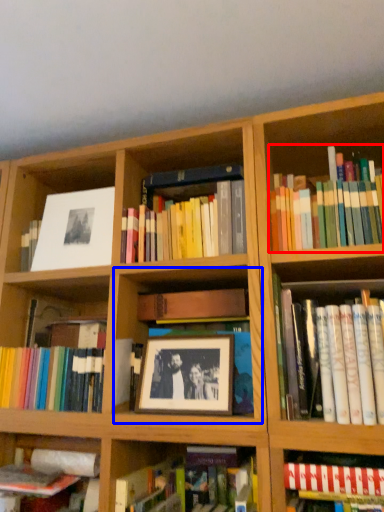
Question: Which object is further to the camera taking this photo, book (highlighted by a red box) or cabinet (highlighted by a blue box)?

Choices:
 (A) book
 (B) cabinet

Answer: (B)